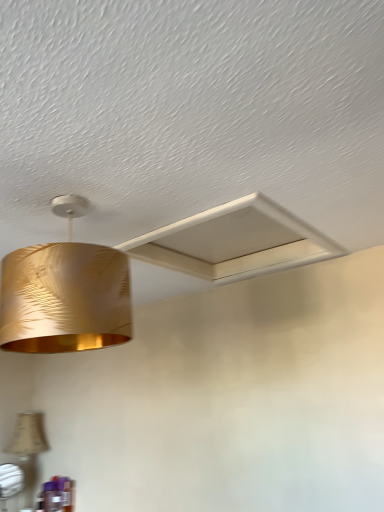
Locate an element on the screen. The width and height of the screenshot is (384, 512). gold metallic lampshade at upper left, the 1th lamp viewed from the right is located at coordinates (65, 293).

Identify the location of the 2nd lamp positioned below the white matte exhaust hood at upper center (from the image's perspective). The width and height of the screenshot is (384, 512). (28, 448).

Between beige fabric lampshade at lower left, placed as the second lamp when sorted from top to bottom, and white matte exhaust hood at upper center, which one appears on the left side from the viewer's perspective?

Positioned to the left is beige fabric lampshade at lower left, placed as the second lamp when sorted from top to bottom.

Based on the photo, from the image's perspective, which is above, beige fabric lampshade at lower left, placed as the first lamp when sorted from left to right, or white matte exhaust hood at upper center?

white matte exhaust hood at upper center is shown above in the image.

Looking at this image, which object is closer to the camera, beige fabric lampshade at lower left, the first lamp ordered from the bottom, or white matte exhaust hood at upper center?

Positioned in front is white matte exhaust hood at upper center.

Considering the sizes of objects white matte exhaust hood at upper center and gold metallic lampshade at upper left, which ranks as the second lamp in back-to-front order, in the image provided, who is bigger, white matte exhaust hood at upper center or gold metallic lampshade at upper left, which ranks as the second lamp in back-to-front order,?

Bigger between the two is gold metallic lampshade at upper left, which ranks as the second lamp in back-to-front order.

How far apart are white matte exhaust hood at upper center and gold metallic lampshade at upper left, which ranks as the second lamp in back-to-front order?

20.45 inches.

Would you say white matte exhaust hood at upper center is to the left or to the right of gold metallic lampshade at upper left, which is the 1th lamp in top-to-bottom order, in the picture?

white matte exhaust hood at upper center is to the right of gold metallic lampshade at upper left, which is the 1th lamp in top-to-bottom order.

Who is shorter, white matte exhaust hood at upper center or gold metallic lampshade at upper left, which is the second lamp in bottom-to-top order?

Standing shorter between the two is white matte exhaust hood at upper center.

Which of these two, gold metallic lampshade at upper left, the 1th lamp when ordered from front to back, or white matte exhaust hood at upper center, stands taller?

Standing taller between the two is gold metallic lampshade at upper left, the 1th lamp when ordered from front to back.

Considering the relative sizes of gold metallic lampshade at upper left, which is the second lamp in bottom-to-top order, and white matte exhaust hood at upper center in the image provided, is gold metallic lampshade at upper left, which is the second lamp in bottom-to-top order, wider than white matte exhaust hood at upper center?

In fact, gold metallic lampshade at upper left, which is the second lamp in bottom-to-top order, might be narrower than white matte exhaust hood at upper center.

Image resolution: width=384 pixels, height=512 pixels. There is a white matte exhaust hood at upper center. Identify the location of the 1st lamp below it (from the image's perspective). (65, 293).

Based on the photo, from the image's perspective, does gold metallic lampshade at upper left, which is the second lamp in bottom-to-top order, appear lower than white matte exhaust hood at upper center?

Yes, from the image's perspective, gold metallic lampshade at upper left, which is the second lamp in bottom-to-top order, is below white matte exhaust hood at upper center.

Identify the location of lamp below the gold metallic lampshade at upper left, which appears as the 2th lamp when viewed from the left (from the image's perspective). Image resolution: width=384 pixels, height=512 pixels. (28, 448).

Are gold metallic lampshade at upper left, which ranks as the second lamp in back-to-front order, and beige fabric lampshade at lower left, the second lamp from the front, making contact?

No, gold metallic lampshade at upper left, which ranks as the second lamp in back-to-front order, is not making contact with beige fabric lampshade at lower left, the second lamp from the front.

From a real-world perspective, who is located higher, gold metallic lampshade at upper left, which ranks as the second lamp in back-to-front order, or beige fabric lampshade at lower left, the first lamp ordered from the bottom?

gold metallic lampshade at upper left, which ranks as the second lamp in back-to-front order, from a real-world perspective.

Is gold metallic lampshade at upper left, which appears as the 2th lamp when viewed from the left, not within beige fabric lampshade at lower left, which is the first lamp in back-to-front order?

Answer: gold metallic lampshade at upper left, which appears as the 2th lamp when viewed from the left, is positioned outside beige fabric lampshade at lower left, which is the first lamp in back-to-front order.

Looking at the image, does beige fabric lampshade at lower left, which is the first lamp in back-to-front order, seem bigger or smaller compared to gold metallic lampshade at upper left, which ranks as the second lamp in back-to-front order?

In the image, beige fabric lampshade at lower left, which is the first lamp in back-to-front order, appears to be smaller than gold metallic lampshade at upper left, which ranks as the second lamp in back-to-front order.

Is the surface of beige fabric lampshade at lower left, the second lamp from the front, in direct contact with gold metallic lampshade at upper left, the 1th lamp viewed from the right?

No, beige fabric lampshade at lower left, the second lamp from the front, is not touching gold metallic lampshade at upper left, the 1th lamp viewed from the right.

How many degrees apart are the facing directions of beige fabric lampshade at lower left, the first lamp ordered from the bottom, and gold metallic lampshade at upper left, which is the 1th lamp in top-to-bottom order?

5.53 degrees.

From the image's perspective, is beige fabric lampshade at lower left, which is the first lamp in back-to-front order, beneath gold metallic lampshade at upper left, which is the second lamp in bottom-to-top order?

Yes, from the image's perspective, beige fabric lampshade at lower left, which is the first lamp in back-to-front order, is below gold metallic lampshade at upper left, which is the second lamp in bottom-to-top order.

Is point (279, 255) closer to viewer compared to point (43, 449)?

Yes.

From the picture: From a real-world perspective, between white matte exhaust hood at upper center and beige fabric lampshade at lower left, the second lamp from the front, who is vertically lower?

beige fabric lampshade at lower left, the second lamp from the front, from a real-world perspective.

Is white matte exhaust hood at upper center turned away from beige fabric lampshade at lower left, the second lamp from the front?

No, beige fabric lampshade at lower left, the second lamp from the front, is not at the back of white matte exhaust hood at upper center.

Is beige fabric lampshade at lower left, acting as the 2th lamp starting from the right, surrounded by white matte exhaust hood at upper center?

Actually, beige fabric lampshade at lower left, acting as the 2th lamp starting from the right, is outside white matte exhaust hood at upper center.

Identify the location of the 2nd lamp counting from the left of the white matte exhaust hood at upper center. The width and height of the screenshot is (384, 512). (28, 448).

Identify the location of exhaust hood that appears above the gold metallic lampshade at upper left, the 1th lamp when ordered from front to back (from a real-world perspective). This screenshot has height=512, width=384. (234, 242).

Estimate the real-world distances between objects in this image. Which object is closer to gold metallic lampshade at upper left, which ranks as the second lamp in back-to-front order, beige fabric lampshade at lower left, the second lamp from the front, or white matte exhaust hood at upper center?

white matte exhaust hood at upper center is closer to gold metallic lampshade at upper left, which ranks as the second lamp in back-to-front order.

Which object lies further to the anchor point beige fabric lampshade at lower left, acting as the 2th lamp starting from the right, white matte exhaust hood at upper center or gold metallic lampshade at upper left, which is the 1th lamp in top-to-bottom order?

gold metallic lampshade at upper left, which is the 1th lamp in top-to-bottom order, lies further to beige fabric lampshade at lower left, acting as the 2th lamp starting from the right, than the other object.

Looking at the image, which one is located closer to white matte exhaust hood at upper center, gold metallic lampshade at upper left, which appears as the 2th lamp when viewed from the left, or beige fabric lampshade at lower left, placed as the second lamp when sorted from top to bottom?

Among the two, gold metallic lampshade at upper left, which appears as the 2th lamp when viewed from the left, is located nearer to white matte exhaust hood at upper center.

Estimate the real-world distances between objects in this image. Which object is further from beige fabric lampshade at lower left, the first lamp ordered from the bottom, gold metallic lampshade at upper left, which is the second lamp in bottom-to-top order, or white matte exhaust hood at upper center?

Based on the image, gold metallic lampshade at upper left, which is the second lamp in bottom-to-top order, appears to be further to beige fabric lampshade at lower left, the first lamp ordered from the bottom.

Estimate the real-world distances between objects in this image. Which object is further from gold metallic lampshade at upper left, the 1th lamp when ordered from front to back, white matte exhaust hood at upper center or beige fabric lampshade at lower left, placed as the first lamp when sorted from left to right?

Among the two, beige fabric lampshade at lower left, placed as the first lamp when sorted from left to right, is located further to gold metallic lampshade at upper left, the 1th lamp when ordered from front to back.

When comparing their distances from white matte exhaust hood at upper center, does beige fabric lampshade at lower left, placed as the first lamp when sorted from left to right, or gold metallic lampshade at upper left, which is the second lamp in bottom-to-top order, seem further?

beige fabric lampshade at lower left, placed as the first lamp when sorted from left to right.

Image resolution: width=384 pixels, height=512 pixels. Identify the location of exhaust hood positioned between gold metallic lampshade at upper left, which is the second lamp in bottom-to-top order, and beige fabric lampshade at lower left, which is the first lamp in back-to-front order, from near to far. (234, 242).